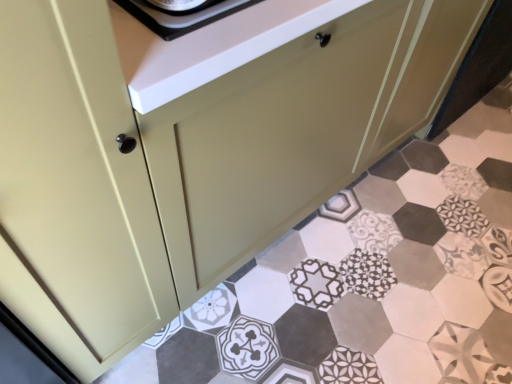
This screenshot has width=512, height=384. Describe the element at coordinates (182, 15) in the screenshot. I see `white glossy stovetop at upper center` at that location.

The width and height of the screenshot is (512, 384). Identify the location of white glossy stovetop at upper center. (182, 15).

At what (x,y) coordinates should I click in order to perform the action: click on white glossy stovetop at upper center. Please return your answer as a coordinate pair (x, y). Looking at the image, I should click on (182, 15).